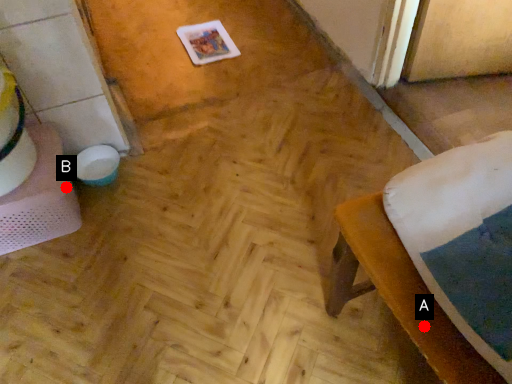
Question: Two points are circled on the image, labeled by A and B beside each circle. Which point appears farthest from the camera in this image?

Choices:
 (A) A is further
 (B) B is further

Answer: (B)